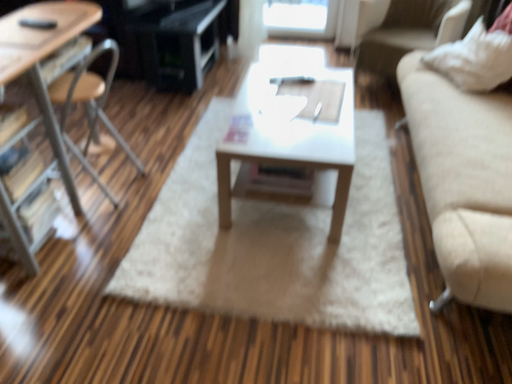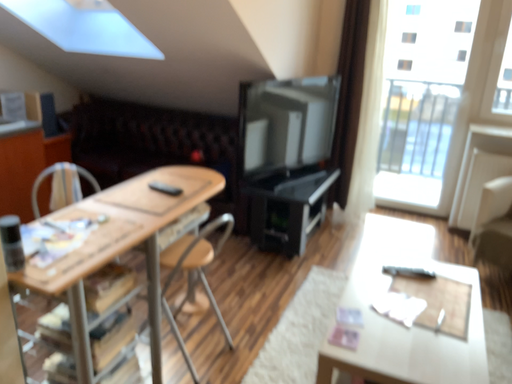
Question: How did the camera likely rotate when shooting the video?

Choices:
 (A) rotated left
 (B) rotated right

Answer: (A)